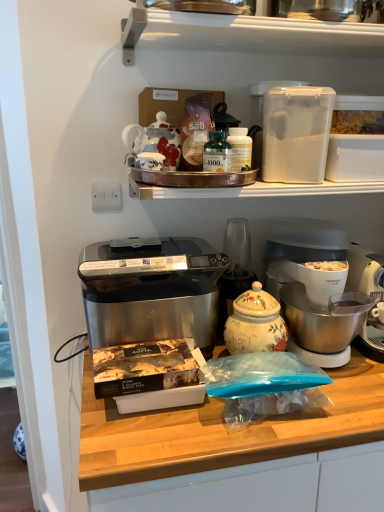
Question: Is green glass bottle at center in front of or behind stainless steel appliance at center in the image?

Choices:
 (A) front
 (B) behind

Answer: (B)

Question: Is green glass bottle at center spatially inside stainless steel appliance at center, or outside of it?

Choices:
 (A) inside
 (B) outside

Answer: (B)

Question: Which of these objects is positioned farthest from the white plastic coffee maker at lower right?

Choices:
 (A) transparent plastic container at upper right, the 1th appliance positioned from the right
 (B) decorative ceramic jar at center
 (C) satin black toaster oven at center
 (D) porcelain teapot at upper center, marked as the second appliance in a right-to-left arrangement
 (E) stainless steel appliance at center

Answer: (D)

Question: Which object is the farthest from the decorative ceramic jar at center?

Choices:
 (A) white plastic container at upper center
 (B) porcelain teapot at upper center, marked as the second appliance in a right-to-left arrangement
 (C) transparent plastic container at upper right, which appears as the second appliance when viewed from the left
 (D) satin black toaster oven at center
 (E) stainless steel appliance at center

Answer: (A)